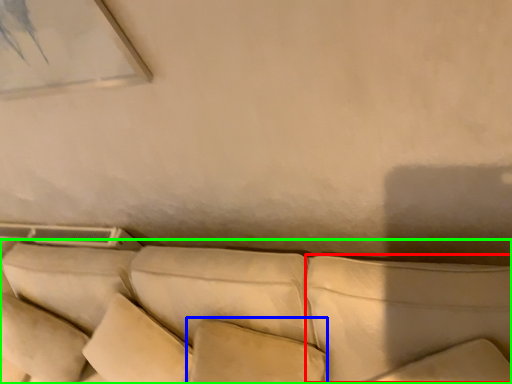
Question: Estimate the real-world distances between objects in this image. Which object is closer to pillow (highlighted by a red box), pillow (highlighted by a blue box) or studio couch (highlighted by a green box)?

Choices:
 (A) pillow
 (B) studio couch

Answer: (B)